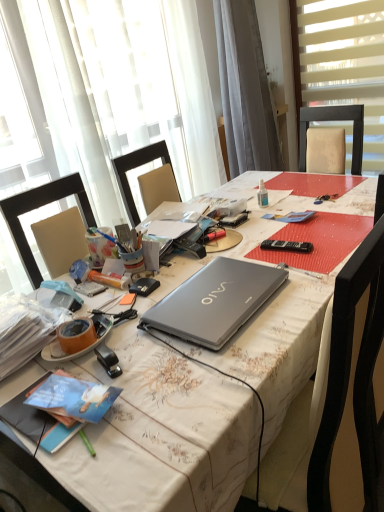
Image resolution: width=384 pixels, height=512 pixels. Identify the location of vacant space that is in between silver metallic laptop at center and blue matte book at lower left, which ranks as the first book in bottom-to-top order. (143, 361).